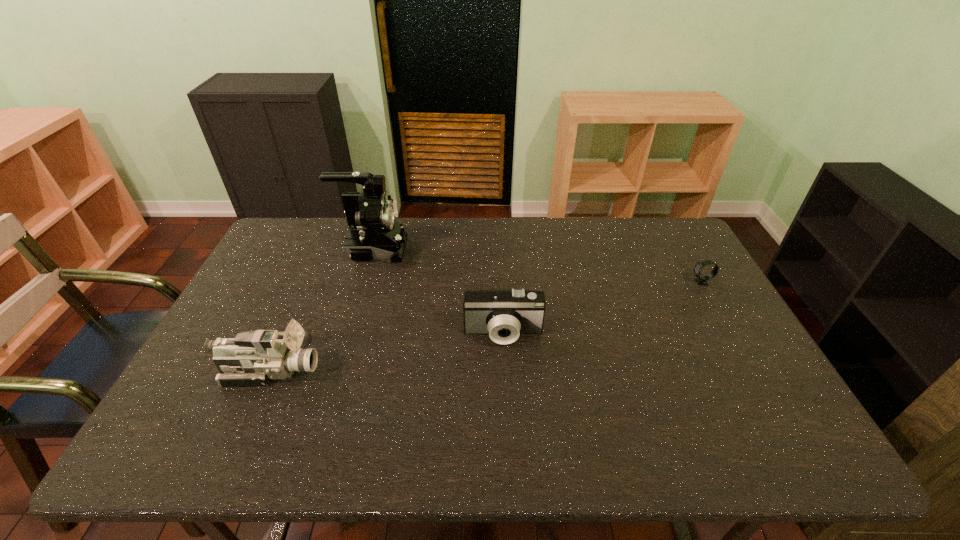
The height and width of the screenshot is (540, 960). I want to click on free region at the right edge, so click(x=670, y=300).

At what (x,y) coordinates should I click in order to perform the action: click on vacant space at the near left corner of the desktop. Please return your answer as a coordinate pair (x, y). Image resolution: width=960 pixels, height=540 pixels. Looking at the image, I should click on (213, 451).

Find the location of `vacant point at the near right corner`. vacant point at the near right corner is located at coordinates (738, 450).

This screenshot has width=960, height=540. I want to click on vacant area that lies between the nearest object and the farthest object, so click(322, 310).

This screenshot has height=540, width=960. Find the location of `vacant space that is in between the tallest camcorder and the shortest object`. vacant space that is in between the tallest camcorder and the shortest object is located at coordinates (538, 266).

Find the location of a particular element. This screenshot has width=960, height=540. vacant area that lies between the rightmost object and the farthest object is located at coordinates (538, 266).

The width and height of the screenshot is (960, 540). I want to click on empty location between the farthest object and the second shortest object, so click(439, 292).

At what (x,y) coordinates should I click in order to perform the action: click on vacant area between the shortest object and the rightmost camcorder. Please return your answer as a coordinate pair (x, y). This screenshot has width=960, height=540. Looking at the image, I should click on (602, 308).

You are a GUI agent. You are given a task and a screenshot of the screen. Output one action in this format:
    pyautogui.click(x=<x>, y=<y>)
    Task: Click on the vacant space that's between the second farthest camcorder and the watch
    
    Given the screenshot: What is the action you would take?
    pyautogui.click(x=602, y=308)

The image size is (960, 540). In order to click on free space between the tallest object and the shortest object in this screenshot , I will do `click(538, 266)`.